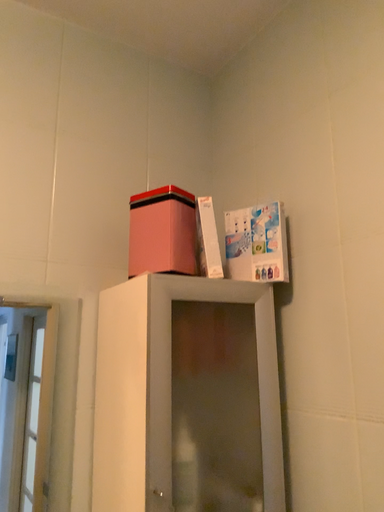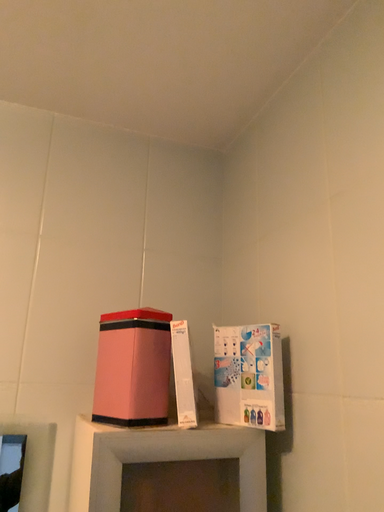
Question: Which way did the camera rotate in the video?

Choices:
 (A) rotated right
 (B) rotated left

Answer: (B)